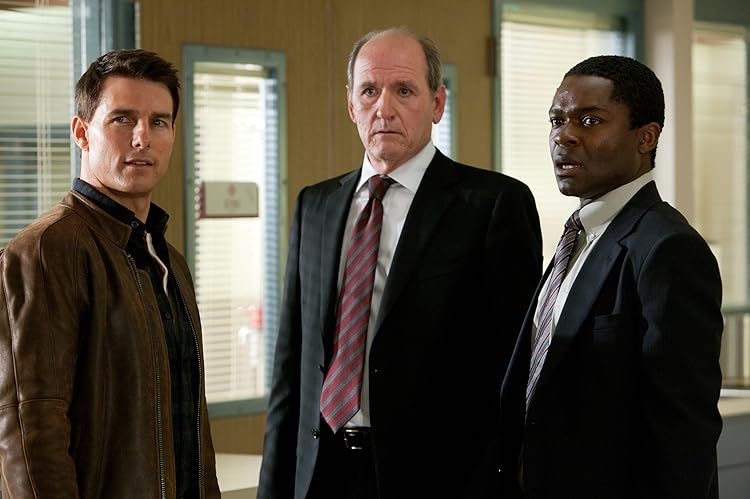
Locate an element on the screen. wall is located at coordinates (292, 21).